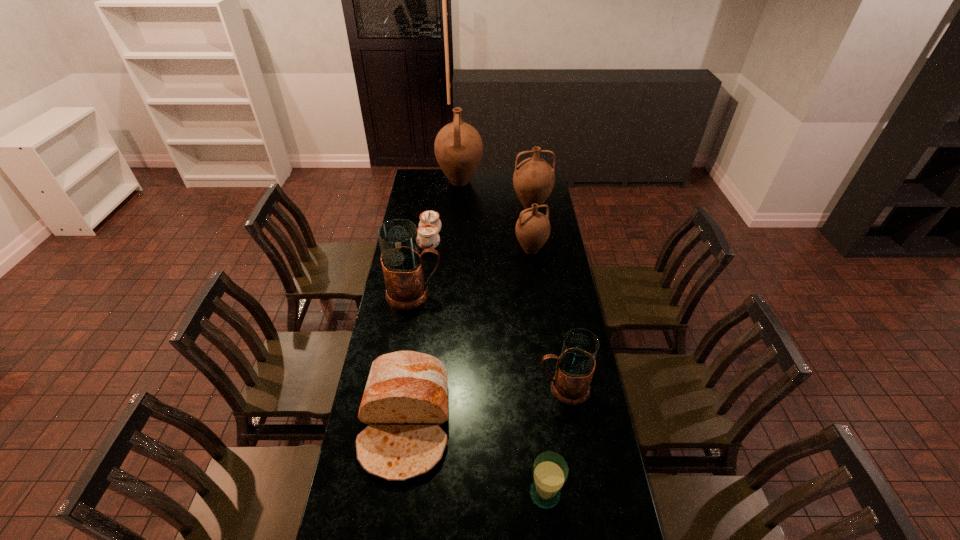
I want to click on vacant space located at the sliced end of the bread, so click(392, 523).

The height and width of the screenshot is (540, 960). Identify the location of vacant space situated 0.150m by the handle of the white chinaware. (470, 241).

Find the location of a particular element. This screenshot has width=960, height=540. free spot located 0.170m on the right of the blue glass is located at coordinates (617, 494).

Find the location of `object at the far edge`. object at the far edge is located at coordinates (458, 146).

Find the location of a particular element. The width and height of the screenshot is (960, 540). bread that is at the left edge is located at coordinates (405, 400).

Find the location of a particular element. The width and height of the screenshot is (960, 540). chinaware that is at the left edge is located at coordinates (430, 225).

The height and width of the screenshot is (540, 960). Find the location of `object that is at the far left corner`. object that is at the far left corner is located at coordinates (458, 146).

Where is `free space at the left edge of the desktop`? free space at the left edge of the desktop is located at coordinates (395, 308).

You are a GUI agent. You are given a task and a screenshot of the screen. Output one action in this format:
    pyautogui.click(x=<x>, y=<y>)
    Task: Click on the vacant space at the right edge of the desktop
    The width and height of the screenshot is (960, 540).
    Given the screenshot: What is the action you would take?
    pyautogui.click(x=616, y=504)

Image resolution: width=960 pixels, height=540 pixels. What are the coordinates of `vacant space at the far left corner` in the screenshot? It's located at (424, 182).